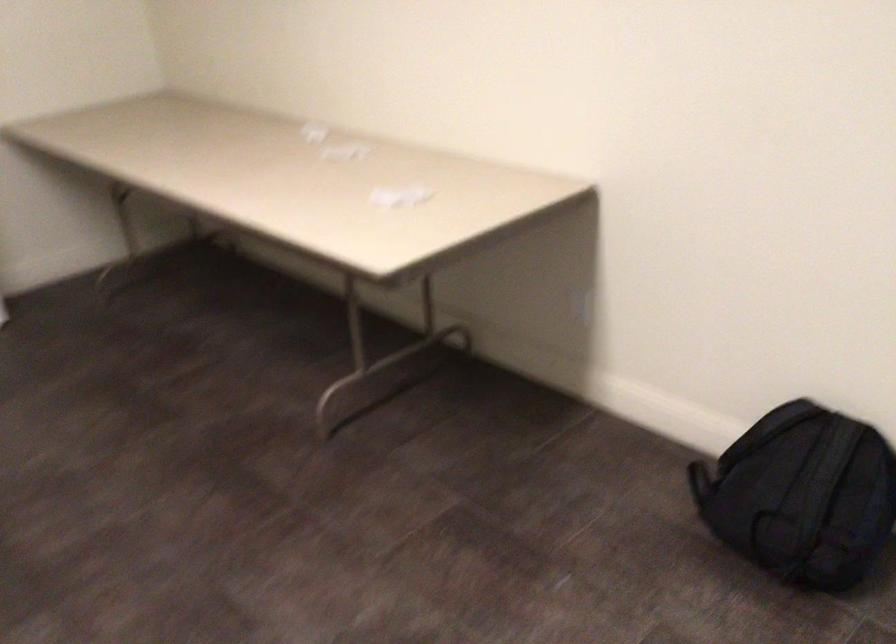
Which object does [803,496] point to?

It corresponds to the black backpack in the image.